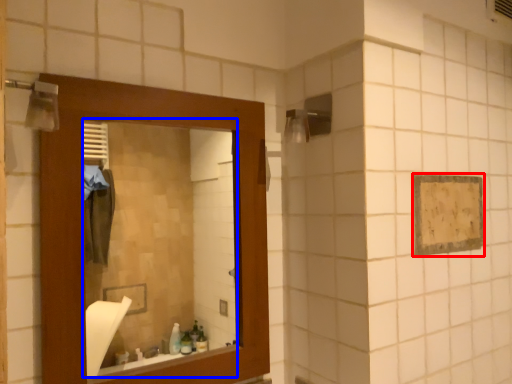
Question: Which point is closer to the camera, square (highlighted by a red box) or mirror (highlighted by a blue box)?

Choices:
 (A) square
 (B) mirror

Answer: (B)